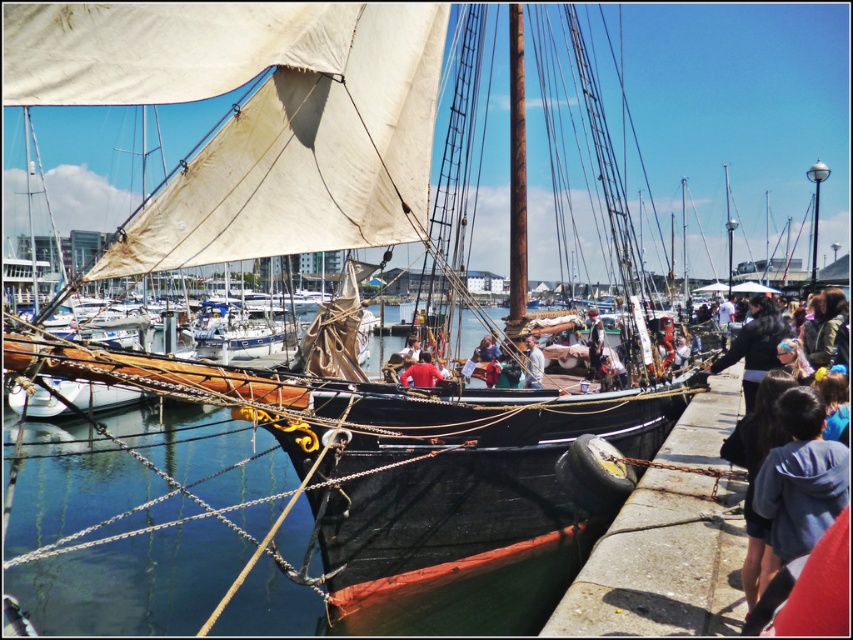
Question: Based on their relative distances, which object is nearer to the blue fleece jacket at lower right?

Choices:
 (A) rustic concrete dock at lower right
 (B) rusty wood mast at center
 (C) red matte shirt at center

Answer: (A)

Question: Observing the image, what is the correct spatial positioning of denim jacket at right in reference to matte brown jacket at center?

Choices:
 (A) left
 (B) right

Answer: (B)

Question: Which point is farther from the camera taking this photo?

Choices:
 (A) (488, 337)
 (B) (698, 452)
 (C) (802, 435)

Answer: (A)

Question: Among these points, which one is nearest to the camera?

Choices:
 (A) (712, 554)
 (B) (527, 364)
 (C) (785, 497)
 (D) (421, 372)

Answer: (C)

Question: Can you confirm if dark brown leather jacket at center is positioned below matte brown jacket at center?

Choices:
 (A) no
 (B) yes

Answer: (A)

Question: In this image, where is rustic concrete dock at lower right located relative to red matte shirt at center?

Choices:
 (A) right
 (B) left

Answer: (A)